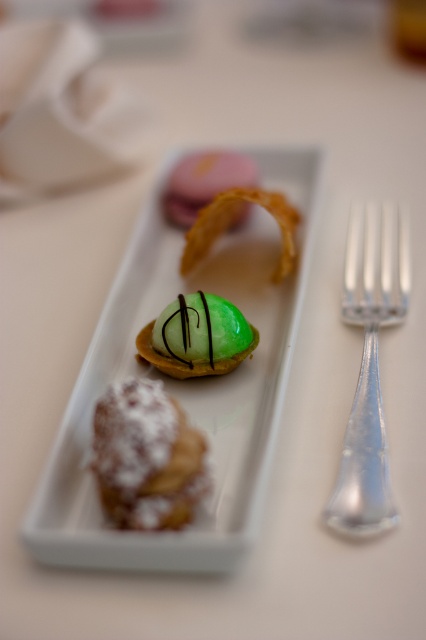
Based on the photo, you are a dessert chef who wants to stack the green glossy tartlet at center and the pink matte macaron at center on top of each other. Which dessert should be placed at the bottom to ensure stability?

The green glossy tartlet at center has a lesser height compared to the pink matte macaron at center, so placing the taller pink matte macaron at center at the bottom would provide a more stable base for the stack.